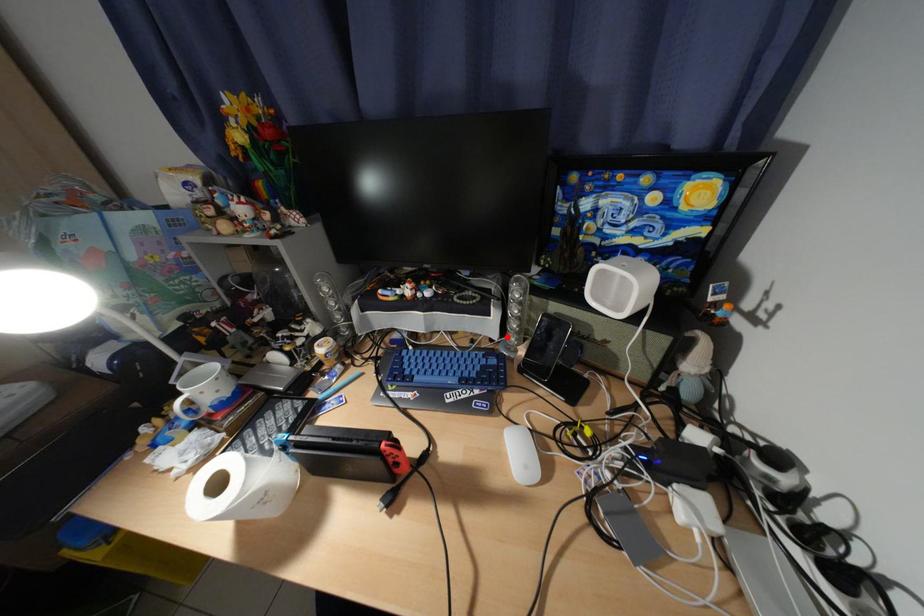
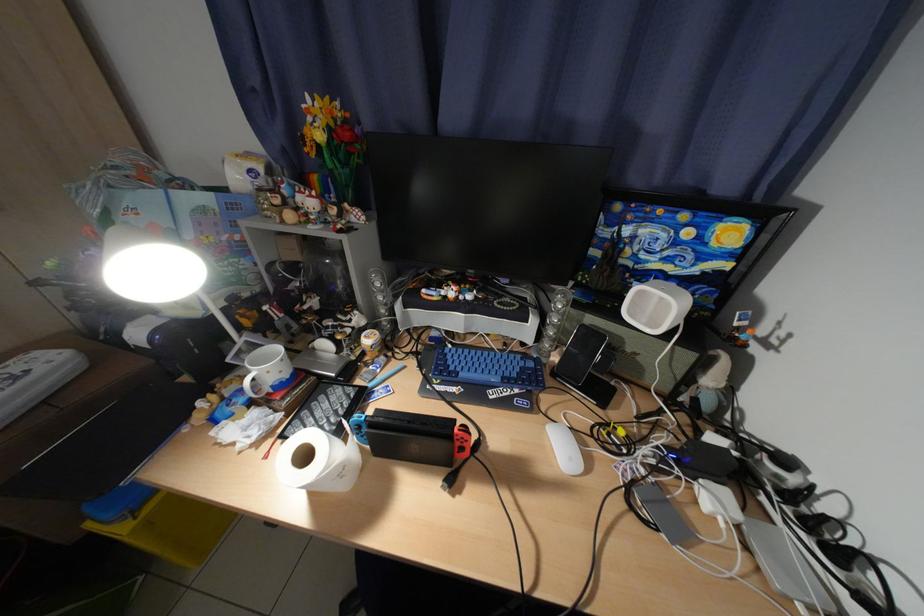
In the second image, find the point that corresponds to the highlighted location in the first image.

(541, 342)